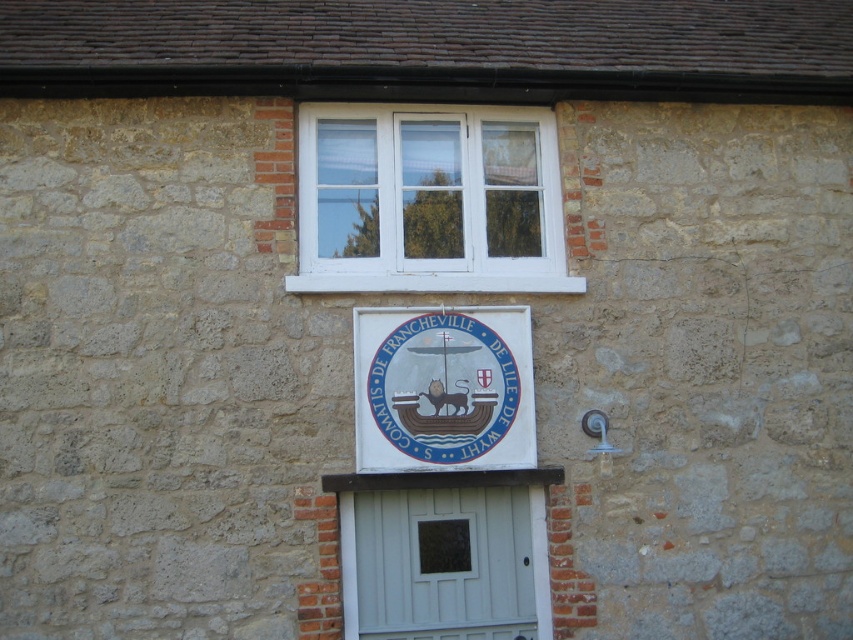
From the picture: You are standing in front of the stone building. You see a point marked at coordinates (428, 200). What object does this point correspond to?

The point corresponds to the white plastic window at upper center.

You are standing in front of the stone building and want to enter through the entrance. Which object should you approach first, the white painted wood door at center or the white glossy sign at center?

You should approach the white painted wood door at center first because it is larger than the white glossy sign at center, indicating it is the main entrance.

You are standing in front of the stone building and want to locate the white glossy sign at center. Based on the white plastic window at upper center, where should you look relative to it?

The white glossy sign at center is below the white plastic window at upper center, so you should look downward from the window to find the sign.